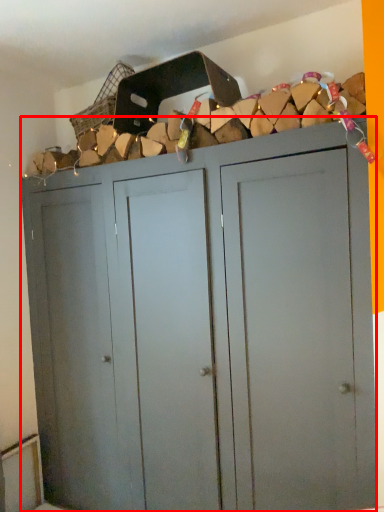
Question: From the image's perspective, what is the correct spatial positioning of cupboard (annotated by the red box) in reference to basket?

Choices:
 (A) above
 (B) below

Answer: (B)